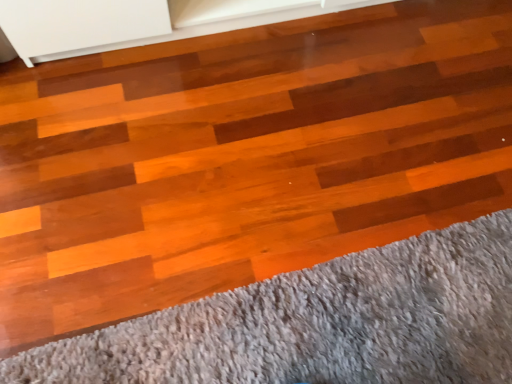
This screenshot has height=384, width=512. What are the coordinates of `blank space above gray shaggy rug at lower right (from a real-world perspective)` in the screenshot? It's located at (328, 317).